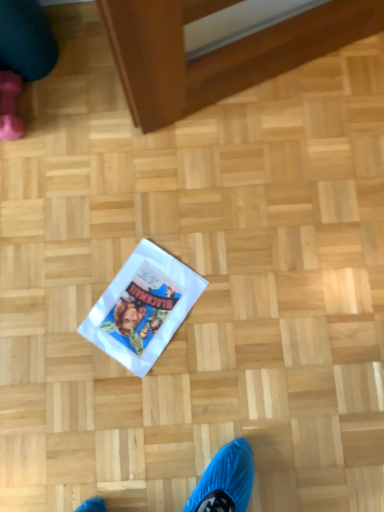
This screenshot has width=384, height=512. I want to click on free point below teal fabric leg at upper left (from a real-world perspective), so (51, 62).